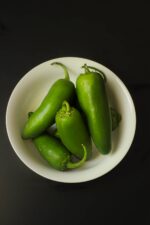
Locate an element on the screen. white bowl edge is located at coordinates (82, 182).